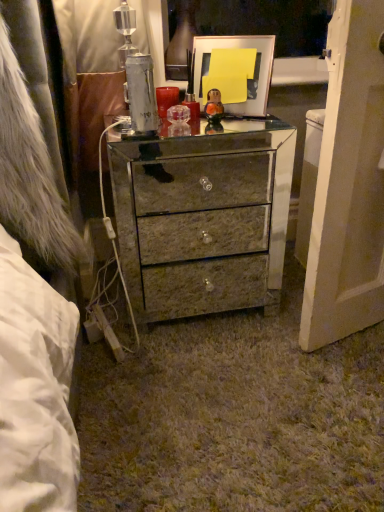
Question: Is mirrored glass chest of drawers at center surrounding metallic gold picture frame at upper center?

Choices:
 (A) yes
 (B) no

Answer: (B)

Question: Is mirrored glass chest of drawers at center smaller than metallic gold picture frame at upper center?

Choices:
 (A) yes
 (B) no

Answer: (B)

Question: Is mirrored glass chest of drawers at center not close to metallic gold picture frame at upper center?

Choices:
 (A) no
 (B) yes

Answer: (A)

Question: From the image's perspective, is mirrored glass chest of drawers at center located beneath metallic gold picture frame at upper center?

Choices:
 (A) yes
 (B) no

Answer: (A)

Question: Would you say mirrored glass chest of drawers at center is outside metallic gold picture frame at upper center?

Choices:
 (A) no
 (B) yes

Answer: (B)

Question: Is mirrored glass chest of drawers at center oriented away from metallic gold picture frame at upper center?

Choices:
 (A) yes
 (B) no

Answer: (B)

Question: From a real-world perspective, does metallic gold picture frame at upper center sit lower than mirrored glass chest of drawers at center?

Choices:
 (A) yes
 (B) no

Answer: (B)

Question: Can you confirm if metallic gold picture frame at upper center is bigger than mirrored glass chest of drawers at center?

Choices:
 (A) no
 (B) yes

Answer: (A)

Question: Does metallic gold picture frame at upper center have a greater width compared to mirrored glass chest of drawers at center?

Choices:
 (A) no
 (B) yes

Answer: (A)

Question: Does metallic gold picture frame at upper center turn towards mirrored glass chest of drawers at center?

Choices:
 (A) yes
 (B) no

Answer: (B)

Question: From a real-world perspective, is metallic gold picture frame at upper center located higher than mirrored glass chest of drawers at center?

Choices:
 (A) yes
 (B) no

Answer: (A)

Question: Is metallic gold picture frame at upper center not near mirrored glass chest of drawers at center?

Choices:
 (A) no
 (B) yes

Answer: (A)

Question: Which is correct: mirrored glass chest of drawers at center is inside metallic gold picture frame at upper center, or outside of it?

Choices:
 (A) inside
 (B) outside

Answer: (B)